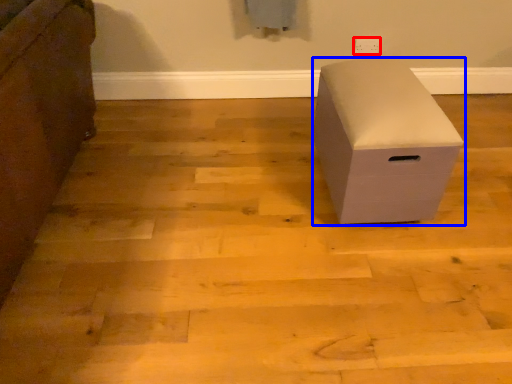
Question: Which point is closer to the camera, electric outlet (highlighted by a red box) or furniture (highlighted by a blue box)?

Choices:
 (A) electric outlet
 (B) furniture

Answer: (B)